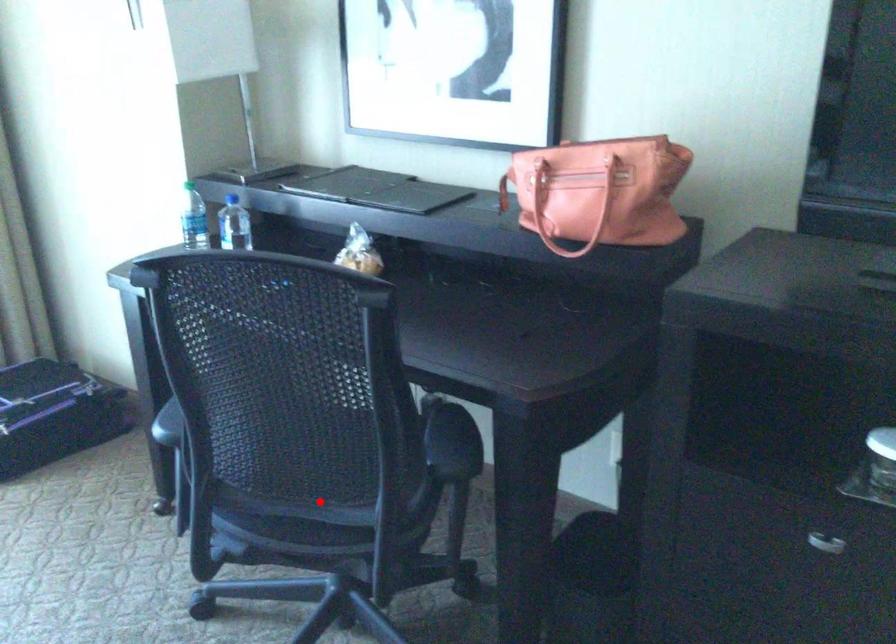
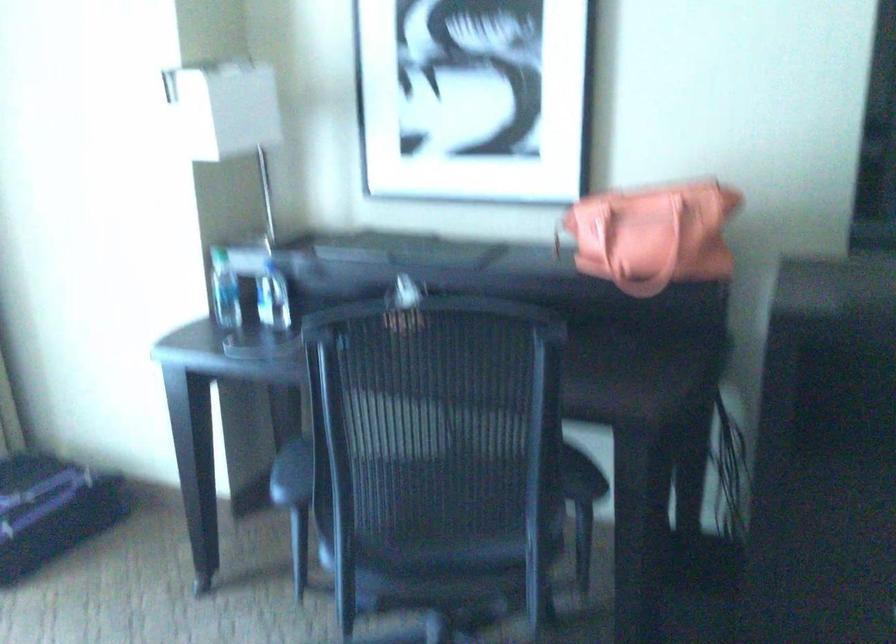
Find the pixel in the second image that matches the highlighted location in the first image.

(458, 544)